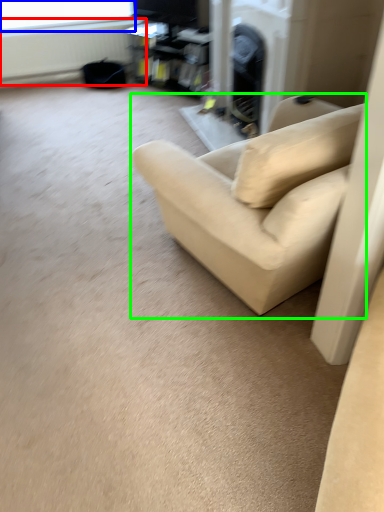
Question: Which object is positioned farthest from radiator (highlighted by a red box)? Select from window screen (highlighted by a blue box) and studio couch (highlighted by a green box).

Choices:
 (A) window screen
 (B) studio couch

Answer: (B)